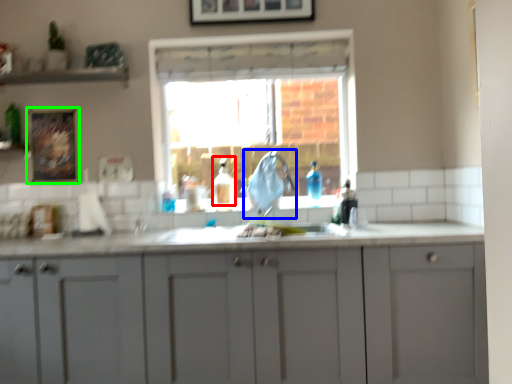
Question: Estimate the real-world distances between objects in this image. Which object is closer to bottle (highlighted by a red box), faucet (highlighted by a blue box) or picture frame (highlighted by a green box)?

Choices:
 (A) faucet
 (B) picture frame

Answer: (A)